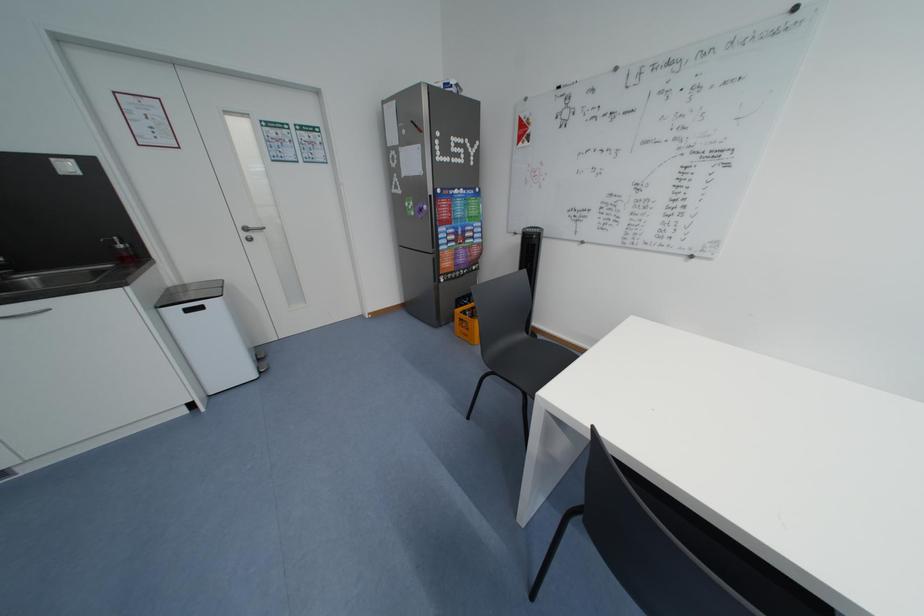
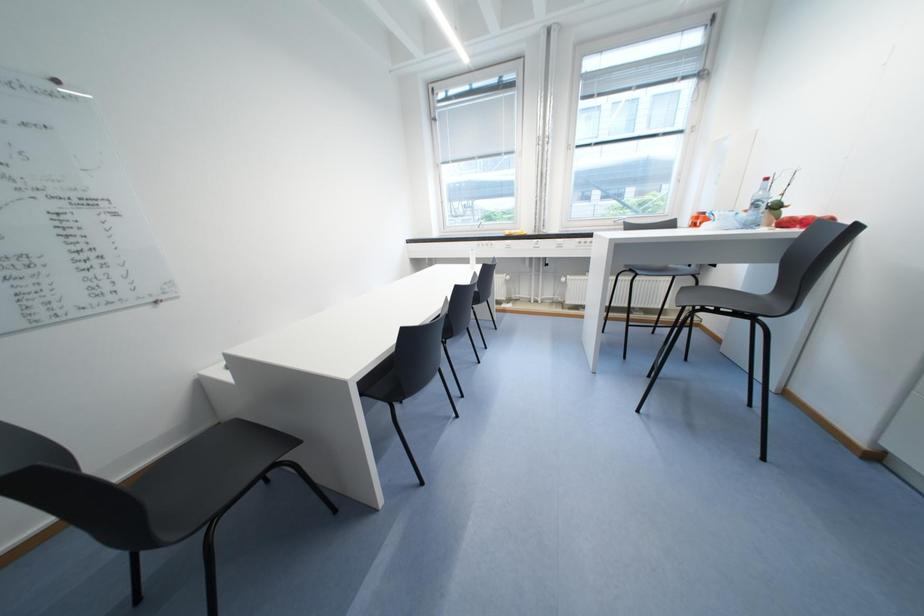
First-person continuous shooting, in which direction is the camera rotating?

The camera's rotation is toward right-down.